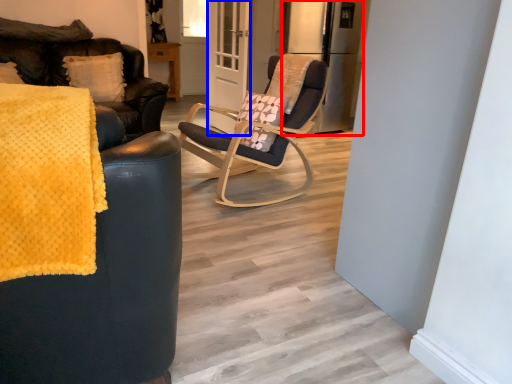
Question: Which object is further to the camera taking this photo, appliance (highlighted by a red box) or screen door (highlighted by a blue box)?

Choices:
 (A) appliance
 (B) screen door

Answer: (A)